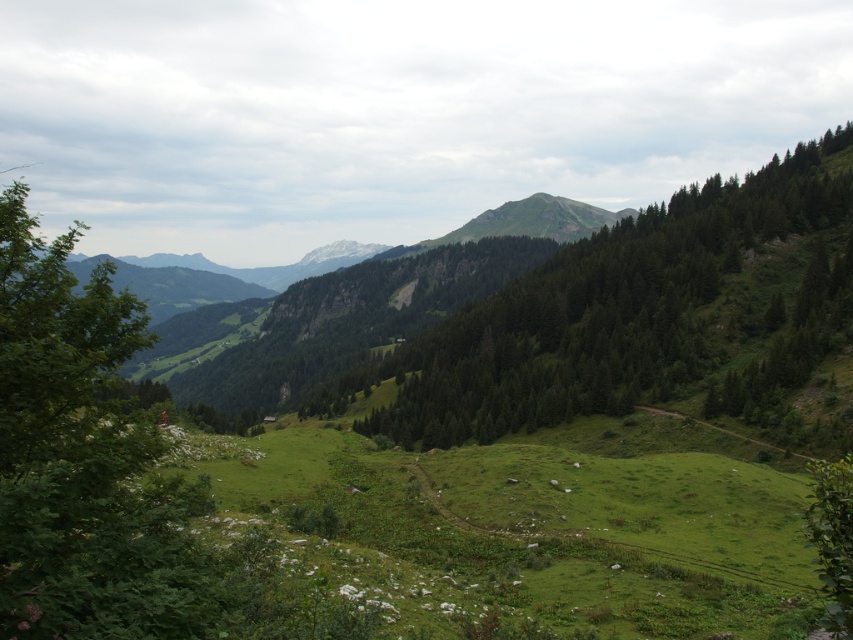
You are standing at the point labeled as point (531, 531) in the image. What type of terrain are you currently standing on?

The point labeled as point (531, 531) is part of the green grassy field at center, so you are standing on grassy terrain.

You are a hiker planning to take a photo of both the green textured tree at center and the green leafy tree at left. Since you want both trees to be clearly visible in the frame, which tree should you position closer to the camera to ensure they appear similar in size?

To make both trees appear similar in size in your photo, you should position the green textured tree at center closer to the camera since it is larger in size compared to the green leafy tree at left. This way, the larger tree will be nearer, balancing their apparent sizes.